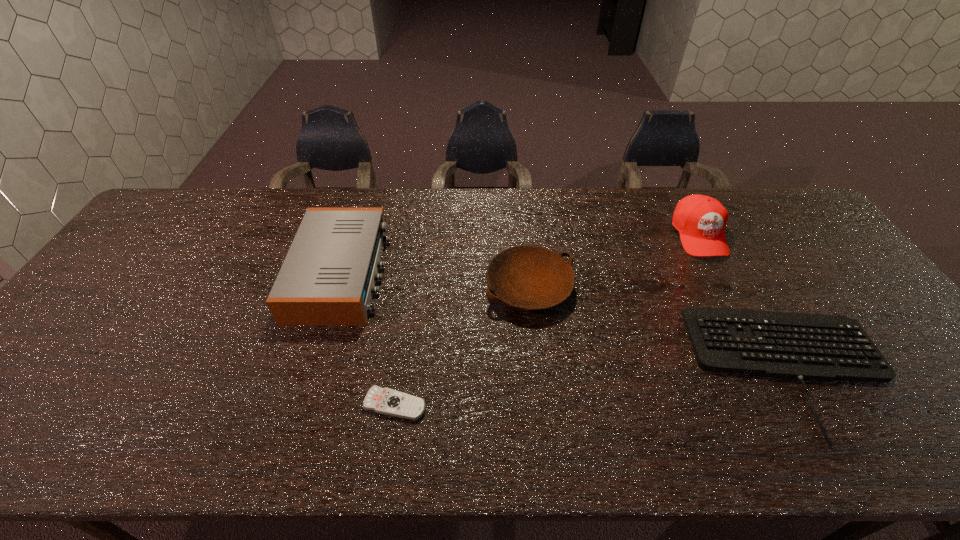
The image size is (960, 540). In the image, there is a desktop. What are the coordinates of `free region at the near edge` in the screenshot? It's located at (205, 450).

Identify the location of vacant space at the left edge. (143, 248).

Where is `free spot at the right edge of the desktop`? This screenshot has height=540, width=960. free spot at the right edge of the desktop is located at coordinates (787, 259).

The height and width of the screenshot is (540, 960). What are the coordinates of `vacant space at the far left corner of the desktop` in the screenshot? It's located at (180, 190).

This screenshot has height=540, width=960. I want to click on vacant space at the near right corner, so click(951, 433).

This screenshot has width=960, height=540. I want to click on unoccupied area between the third tallest object and the fourth object from right to left, so click(x=463, y=346).

What are the coordinates of `blank region between the second tallest object and the fourth tallest object` in the screenshot? It's located at (568, 321).

Find the location of `unoccupied area between the leftmost object and the fourth tallest object`. unoccupied area between the leftmost object and the fourth tallest object is located at coordinates (568, 321).

You are a GUI agent. You are given a task and a screenshot of the screen. Output one action in this format:
    pyautogui.click(x=<x>, y=<y>)
    Task: Click on the vacant area between the third shortest object and the computer keyboard
    The height and width of the screenshot is (540, 960).
    Given the screenshot: What is the action you would take?
    pyautogui.click(x=662, y=328)

At what (x,y) coordinates should I click in order to perform the action: click on vacant area between the tallest object and the computer keyboard. Please return your answer as a coordinate pair (x, y). This screenshot has height=540, width=960. Looking at the image, I should click on (747, 302).